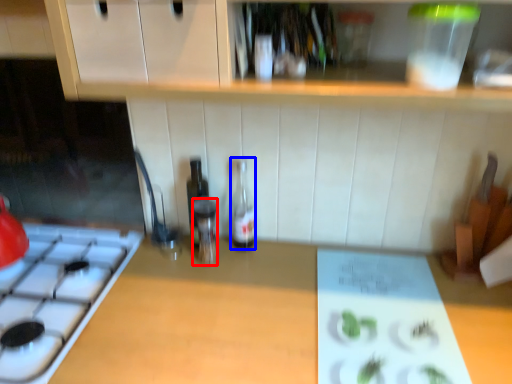
Question: Among these objects, which one is nearest to the camera, bottle (highlighted by a red box) or bottle (highlighted by a blue box)?

Choices:
 (A) bottle
 (B) bottle

Answer: (A)